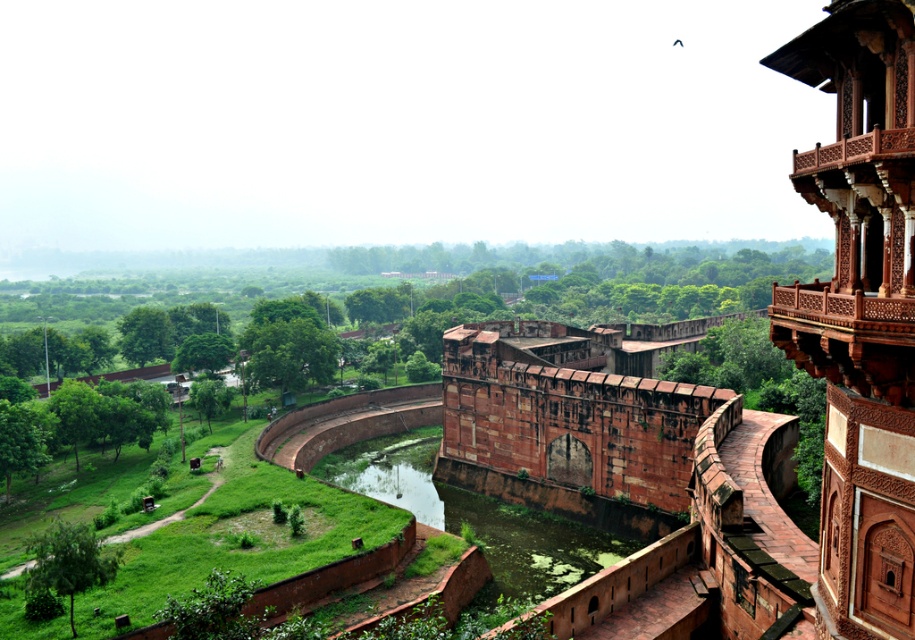
Question: Which of the following is the closest to the observer?

Choices:
 (A) reddish-brown stone fort at right
 (B) green mossy water at center
 (C) rustic stone fortress at center

Answer: (A)

Question: Which point is farther to the camera?

Choices:
 (A) (534, 577)
 (B) (497, 323)
 (C) (684, 536)

Answer: (B)

Question: Is reddish-brown stone fort at right to the right of green mossy water at center from the viewer's perspective?

Choices:
 (A) no
 (B) yes

Answer: (B)

Question: Can you confirm if reddish-brown stone fort at right is smaller than green mossy water at center?

Choices:
 (A) no
 (B) yes

Answer: (A)

Question: Does reddish-brown stone fort at right have a lesser width compared to green mossy water at center?

Choices:
 (A) yes
 (B) no

Answer: (A)

Question: Among these objects, which one is farthest from the camera?

Choices:
 (A) reddish-brown stone fort at right
 (B) green mossy water at center
 (C) rustic stone fortress at center

Answer: (C)